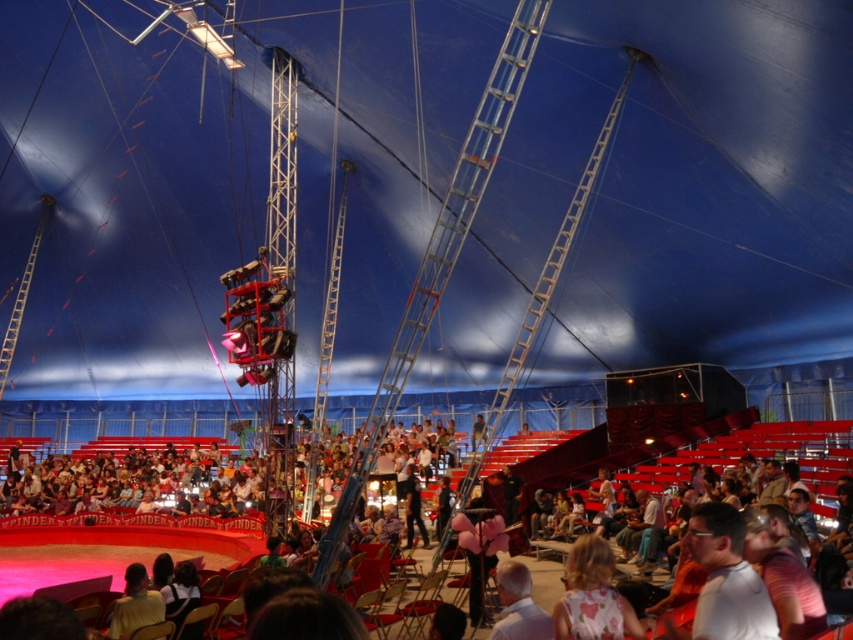
You are a photographer trying to capture a closeup of the white matte shirt at lower center and the light brown hair at lower center during the circus performance. Since the lighting is dim, you need to adjust your camera settings. Which object should you focus on first to ensure proper exposure, considering their sizes?

The white matte shirt at lower center is smaller than the light brown hair at lower center. Since smaller objects may require more precise focus and exposure adjustments in dim lighting, you should focus on the white matte shirt at lower center first to ensure it is properly exposed.

Consider the image. You are a photographer trying to capture a closeup of the white matte shirt at lower center and light brown hair at lower center. Which object is shorter in height?

The white matte shirt at lower center has a lesser height compared to the light brown hair at lower center, so the white matte shirt at lower center is shorter in height.